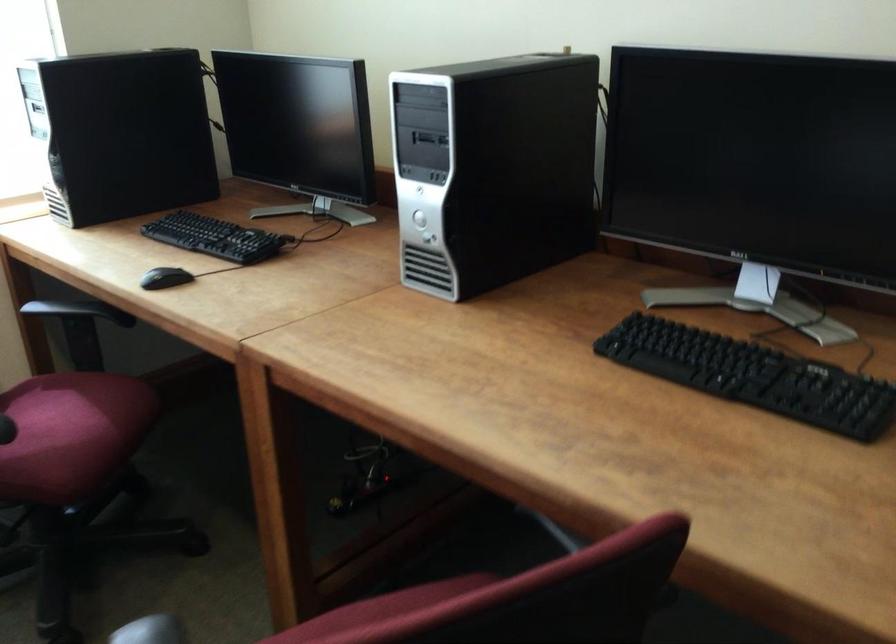
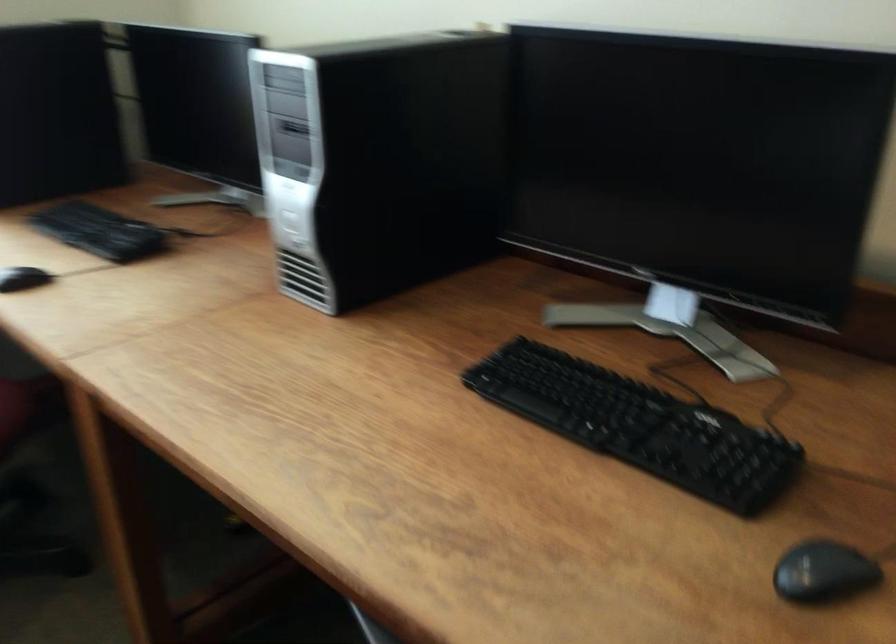
In a continuous first-person perspective shot, in which direction is the camera moving?

The movement direction of the cameraman is right, forward.